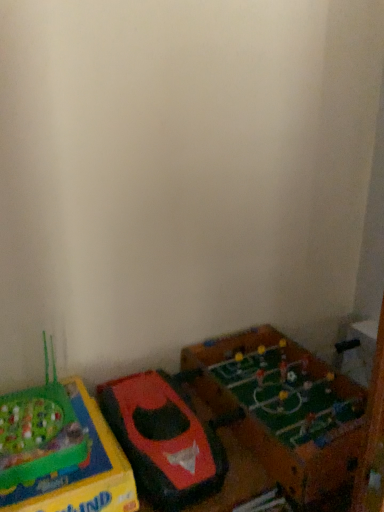
You are a GUI agent. You are given a task and a screenshot of the screen. Output one action in this format:
    pyautogui.click(x=<x>, y=<y>)
    Task: Click on the green plastic game at lower left, which appears as the third toy when viewed from the right
    This screenshot has width=384, height=512.
    Given the screenshot: What is the action you would take?
    pyautogui.click(x=64, y=454)

This screenshot has width=384, height=512. What do you see at coordinates (163, 440) in the screenshot?
I see `rubberized red toy boat at lower left, acting as the 2th toy starting from the right` at bounding box center [163, 440].

I want to click on rubberized red toy boat at lower left, acting as the 2th toy starting from the right, so click(163, 440).

Locate an element on the screen. The height and width of the screenshot is (512, 384). green matte foosball table at lower right, which is the third toy in left-to-right order is located at coordinates (284, 409).

I want to click on green plastic game at lower left, marked as the 1th toy in a left-to-right arrangement, so click(64, 454).

Who is more distant, green matte foosball table at lower right, the 1th toy in the right-to-left sequence, or rubberized red toy boat at lower left, acting as the 2th toy starting from the right?

green matte foosball table at lower right, the 1th toy in the right-to-left sequence, is further away from the camera.

Locate an element on the screen. Image resolution: width=384 pixels, height=512 pixels. toy behind the rubberized red toy boat at lower left, placed as the 2th toy when sorted from left to right is located at coordinates (284, 409).

Can you tell me how much green matte foosball table at lower right, which is the third toy in left-to-right order, and rubberized red toy boat at lower left, placed as the 2th toy when sorted from left to right, differ in facing direction?

They differ by 0.372 degrees in their facing directions.

From a real-world perspective, is green matte foosball table at lower right, which is the third toy in left-to-right order, physically below rubberized red toy boat at lower left, placed as the 2th toy when sorted from left to right?

Yes, from a real-world perspective, green matte foosball table at lower right, which is the third toy in left-to-right order, is beneath rubberized red toy boat at lower left, placed as the 2th toy when sorted from left to right.

Looking at this image, is rubberized red toy boat at lower left, acting as the 2th toy starting from the right, behind green plastic game at lower left, which appears as the third toy when viewed from the right?

Yes, the depth of rubberized red toy boat at lower left, acting as the 2th toy starting from the right, is greater than that of green plastic game at lower left, which appears as the third toy when viewed from the right.

Is green plastic game at lower left, which appears as the third toy when viewed from the right, at the back of rubberized red toy boat at lower left, acting as the 2th toy starting from the right?

rubberized red toy boat at lower left, acting as the 2th toy starting from the right, does not have its back to green plastic game at lower left, which appears as the third toy when viewed from the right.

From the image's perspective, between rubberized red toy boat at lower left, acting as the 2th toy starting from the right, and green plastic game at lower left, which appears as the third toy when viewed from the right, which one is located above?

rubberized red toy boat at lower left, acting as the 2th toy starting from the right, from the image's perspective.

Based on the photo, is rubberized red toy boat at lower left, acting as the 2th toy starting from the right, oriented towards green matte foosball table at lower right, which is the third toy in left-to-right order?

No.

Which is behind, rubberized red toy boat at lower left, placed as the 2th toy when sorted from left to right, or green matte foosball table at lower right, which is the third toy in left-to-right order?

green matte foosball table at lower right, which is the third toy in left-to-right order, is behind.

Would you say rubberized red toy boat at lower left, placed as the 2th toy when sorted from left to right, is a long distance from green matte foosball table at lower right, the 1th toy in the right-to-left sequence?

No.

Is green plastic game at lower left, which appears as the third toy when viewed from the right, beside green matte foosball table at lower right, the 1th toy in the right-to-left sequence?

No.

From a real-world perspective, is green plastic game at lower left, marked as the 1th toy in a left-to-right arrangement, physically below green matte foosball table at lower right, the 1th toy in the right-to-left sequence?

Correct, in the physical world, green plastic game at lower left, marked as the 1th toy in a left-to-right arrangement, is lower than green matte foosball table at lower right, the 1th toy in the right-to-left sequence.

Considering the points (59, 396) and (250, 440), which point is behind, point (59, 396) or point (250, 440)?

The point (250, 440) is farther from the camera.

From a real-world perspective, which object rests below the other?

green plastic game at lower left, which appears as the third toy when viewed from the right, from a real-world perspective.

Does point (282, 374) come behind point (58, 504)?

Yes, point (282, 374) is behind point (58, 504).

How many degrees apart are the facing directions of green matte foosball table at lower right, the 1th toy in the right-to-left sequence, and green plastic game at lower left, marked as the 1th toy in a left-to-right arrangement?

green matte foosball table at lower right, the 1th toy in the right-to-left sequence, and green plastic game at lower left, marked as the 1th toy in a left-to-right arrangement, are facing 2.48 degrees away from each other.

Which of these two, green matte foosball table at lower right, the 1th toy in the right-to-left sequence, or green plastic game at lower left, which appears as the third toy when viewed from the right, stands shorter?

green plastic game at lower left, which appears as the third toy when viewed from the right, is shorter.

From a real-world perspective, is green plastic game at lower left, which appears as the third toy when viewed from the right, located beneath rubberized red toy boat at lower left, placed as the 2th toy when sorted from left to right?

Correct, in the physical world, green plastic game at lower left, which appears as the third toy when viewed from the right, is lower than rubberized red toy boat at lower left, placed as the 2th toy when sorted from left to right.

Which of these two, green plastic game at lower left, which appears as the third toy when viewed from the right, or rubberized red toy boat at lower left, acting as the 2th toy starting from the right, is bigger?

Bigger between the two is rubberized red toy boat at lower left, acting as the 2th toy starting from the right.

From the image's perspective, would you say green plastic game at lower left, which appears as the third toy when viewed from the right, is shown under rubberized red toy boat at lower left, placed as the 2th toy when sorted from left to right?

Yes.

Is point (67, 454) behind point (102, 406)?

No, it is in front of (102, 406).

The image size is (384, 512). I want to click on the 1st toy below the green matte foosball table at lower right, which is the third toy in left-to-right order (from the image's perspective), so click(x=163, y=440).

Find the location of a particular element. This screenshot has height=512, width=384. toy that is on the left side of rubberized red toy boat at lower left, acting as the 2th toy starting from the right is located at coordinates (64, 454).

When comparing their distances from rubberized red toy boat at lower left, placed as the 2th toy when sorted from left to right, does green plastic game at lower left, which appears as the third toy when viewed from the right, or green matte foosball table at lower right, which is the third toy in left-to-right order, seem further?

green matte foosball table at lower right, which is the third toy in left-to-right order, is positioned further to the anchor rubberized red toy boat at lower left, placed as the 2th toy when sorted from left to right.

Which object lies further to the anchor point green matte foosball table at lower right, which is the third toy in left-to-right order, rubberized red toy boat at lower left, placed as the 2th toy when sorted from left to right, or green plastic game at lower left, which appears as the third toy when viewed from the right?

green plastic game at lower left, which appears as the third toy when viewed from the right, lies further to green matte foosball table at lower right, which is the third toy in left-to-right order, than the other object.

Based on their spatial positions, is green plastic game at lower left, which appears as the third toy when viewed from the right, or rubberized red toy boat at lower left, placed as the 2th toy when sorted from left to right, closer to green matte foosball table at lower right, which is the third toy in left-to-right order?

The object closer to green matte foosball table at lower right, which is the third toy in left-to-right order, is rubberized red toy boat at lower left, placed as the 2th toy when sorted from left to right.

Which object lies nearer to the anchor point green plastic game at lower left, which appears as the third toy when viewed from the right, green matte foosball table at lower right, which is the third toy in left-to-right order, or rubberized red toy boat at lower left, acting as the 2th toy starting from the right?

rubberized red toy boat at lower left, acting as the 2th toy starting from the right, is positioned closer to the anchor green plastic game at lower left, which appears as the third toy when viewed from the right.

When comparing their distances from rubberized red toy boat at lower left, placed as the 2th toy when sorted from left to right, does green matte foosball table at lower right, which is the third toy in left-to-right order, or green plastic game at lower left, which appears as the third toy when viewed from the right, seem closer?

green plastic game at lower left, which appears as the third toy when viewed from the right, lies closer to rubberized red toy boat at lower left, placed as the 2th toy when sorted from left to right, than the other object.

When comparing their distances from green plastic game at lower left, which appears as the third toy when viewed from the right, does rubberized red toy boat at lower left, acting as the 2th toy starting from the right, or green matte foosball table at lower right, the 1th toy in the right-to-left sequence, seem further?

green matte foosball table at lower right, the 1th toy in the right-to-left sequence, lies further to green plastic game at lower left, which appears as the third toy when viewed from the right, than the other object.

Where is `toy between green plastic game at lower left, marked as the 1th toy in a left-to-right arrangement, and green matte foosball table at lower right, which is the third toy in left-to-right order, from left to right`? toy between green plastic game at lower left, marked as the 1th toy in a left-to-right arrangement, and green matte foosball table at lower right, which is the third toy in left-to-right order, from left to right is located at coordinates (163, 440).